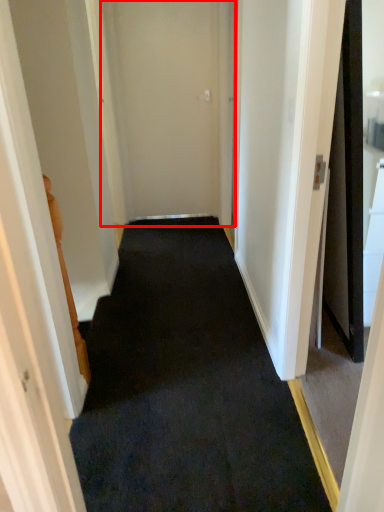
Question: Observing the image, what is the correct spatial positioning of door (annotated by the red box) in reference to doormat?

Choices:
 (A) right
 (B) left

Answer: (B)